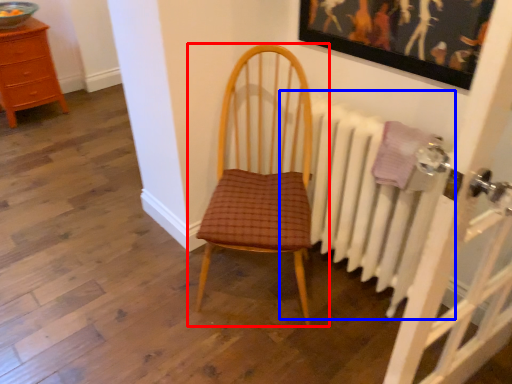
Question: Which object is further to the camera taking this photo, chair (highlighted by a red box) or radiator (highlighted by a blue box)?

Choices:
 (A) chair
 (B) radiator

Answer: (B)